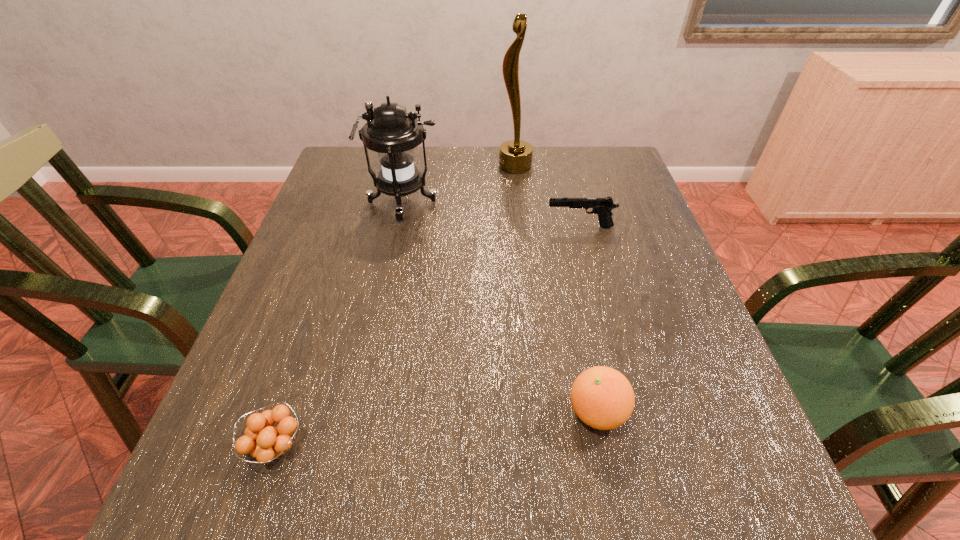
You are a GUI agent. You are given a task and a screenshot of the screen. Output one action in this format:
    pyautogui.click(x=<x>, y=<y>)
    Task: Click on the free space between the award and the gun
    
    Given the screenshot: What is the action you would take?
    pyautogui.click(x=547, y=197)

Locate an element on the screen. The height and width of the screenshot is (540, 960). vacant area that lies between the farthest object and the shortest object is located at coordinates (396, 306).

You are a GUI agent. You are given a task and a screenshot of the screen. Output one action in this format:
    pyautogui.click(x=<x>, y=<y>)
    Task: Click on the free point between the shorter orange fruit and the gun
    This screenshot has height=540, width=960.
    Given the screenshot: What is the action you would take?
    pyautogui.click(x=428, y=336)

Where is `free space between the gun and the taller orange fruit`? The height and width of the screenshot is (540, 960). free space between the gun and the taller orange fruit is located at coordinates (588, 320).

Find the location of a particular element. The image size is (960, 540). empty location between the fourth shortest object and the right orange fruit is located at coordinates (500, 308).

The width and height of the screenshot is (960, 540). What are the coordinates of `vacant region between the taller orange fruit and the gun` in the screenshot? It's located at [x=588, y=320].

Find the location of a particular element. blank region between the award and the gun is located at coordinates (547, 197).

Where is `vacant area between the tallest object and the lantern`? vacant area between the tallest object and the lantern is located at coordinates (459, 185).

At what (x,y) coordinates should I click in order to perform the action: click on empty location between the gun and the tallest object. Please return your answer as a coordinate pair (x, y). Looking at the image, I should click on (547, 197).

Identify the location of vacant area between the second tallest object and the gun. (492, 215).